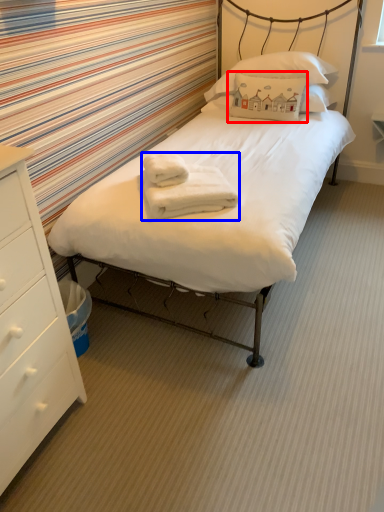
Question: Which point is closer to the camera, pillow (highlighted by a red box) or bath towel (highlighted by a blue box)?

Choices:
 (A) pillow
 (B) bath towel

Answer: (B)